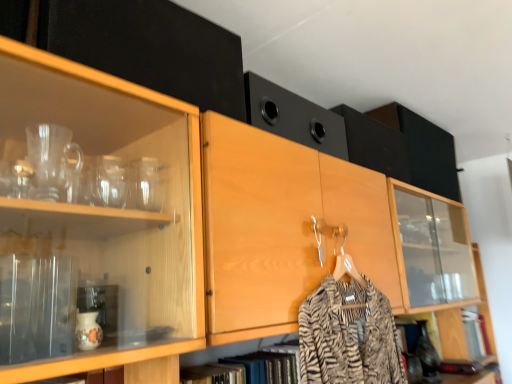
Question: Should I look upward or downward to see black matte speaker at upper center, the 3th cabinetry when ordered from top to bottom?

Choices:
 (A) down
 (B) up

Answer: (B)

Question: Considering the relative sizes of matte black cabinet at upper left, the fourth cabinetry positioned from the right, and wooden cabinet at lower right, the first cabinetry viewed from the right, in the image provided, is matte black cabinet at upper left, the fourth cabinetry positioned from the right, smaller than wooden cabinet at lower right, the first cabinetry viewed from the right,?

Choices:
 (A) no
 (B) yes

Answer: (B)

Question: Could you tell me if matte black cabinet at upper left, the fourth cabinetry when ordered from bottom to top, is facing wooden cabinet at lower right, which appears as the 1th cabinetry when ordered from the bottom?

Choices:
 (A) no
 (B) yes

Answer: (A)

Question: Is matte black cabinet at upper left, acting as the fourth cabinetry starting from the back, thinner than wooden cabinet at lower right, the fourth cabinetry in the top-to-bottom sequence?

Choices:
 (A) no
 (B) yes

Answer: (B)

Question: Considering the relative sizes of matte black cabinet at upper left, the fourth cabinetry positioned from the right, and wooden cabinet at lower right, the fourth cabinetry in the top-to-bottom sequence, in the image provided, is matte black cabinet at upper left, the fourth cabinetry positioned from the right, bigger than wooden cabinet at lower right, the fourth cabinetry in the top-to-bottom sequence,?

Choices:
 (A) yes
 (B) no

Answer: (B)

Question: Is matte black cabinet at upper left, which is the 1th cabinetry from top to bottom, not near wooden cabinet at lower right, placed as the first cabinetry when sorted from back to front?

Choices:
 (A) yes
 (B) no

Answer: (A)

Question: Is matte black cabinet at upper left, which ranks as the first cabinetry in left-to-right order, not inside wooden cabinet at lower right, which appears as the 1th cabinetry when ordered from the bottom?

Choices:
 (A) yes
 (B) no

Answer: (A)

Question: Is the position of wooden cabinet at lower right, the 4th cabinetry in the left-to-right sequence, less distant than that of black matte speaker at upper center, which appears as the 2th cabinetry when ordered from the bottom?

Choices:
 (A) no
 (B) yes

Answer: (A)

Question: Can you confirm if wooden cabinet at lower right, placed as the first cabinetry when sorted from back to front, is thinner than black matte speaker at upper center, the 3th cabinetry viewed from the front?

Choices:
 (A) no
 (B) yes

Answer: (B)

Question: From a real-world perspective, does wooden cabinet at lower right, the first cabinetry viewed from the right, sit lower than black matte speaker at upper center, the 3th cabinetry when ordered from top to bottom?

Choices:
 (A) yes
 (B) no

Answer: (A)

Question: From the image's perspective, is wooden cabinet at lower right, placed as the first cabinetry when sorted from back to front, under black matte speaker at upper center, the 3th cabinetry when ordered from top to bottom?

Choices:
 (A) no
 (B) yes

Answer: (B)

Question: Would you say wooden cabinet at lower right, which is counted as the 4th cabinetry, starting from the front, is a long distance from black matte speaker at upper center, the 3th cabinetry when ordered from left to right?

Choices:
 (A) no
 (B) yes

Answer: (A)

Question: Does wooden cabinet at lower right, the 4th cabinetry in the left-to-right sequence, turn towards black matte speaker at upper center, the 3th cabinetry when ordered from top to bottom?

Choices:
 (A) yes
 (B) no

Answer: (B)

Question: From a real-world perspective, is black matte speaker at upper center, the 3th cabinetry when ordered from left to right, positioned over wooden cabinet at lower right, placed as the first cabinetry when sorted from back to front, based on gravity?

Choices:
 (A) yes
 (B) no

Answer: (A)